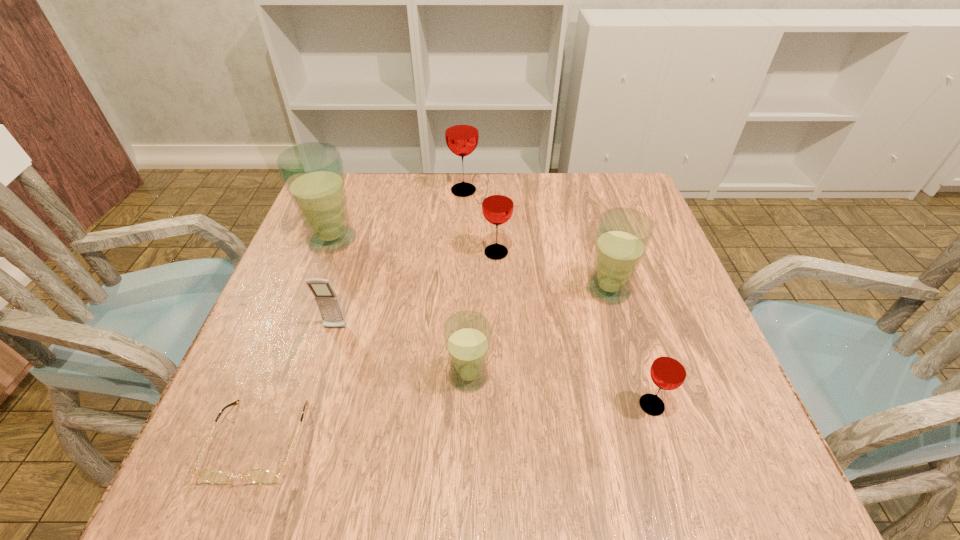
At what (x,y) coordinates should I click in order to perform the action: click on the farthest object. Please return your answer as a coordinate pair (x, y). This screenshot has height=540, width=960. Looking at the image, I should click on (461, 126).

Where is `the biggest red glass`? the biggest red glass is located at coordinates (461, 126).

Where is `the biggest blue glass`? This screenshot has width=960, height=540. the biggest blue glass is located at coordinates (313, 173).

You are a GUI agent. You are given a task and a screenshot of the screen. Output one action in this format:
    pyautogui.click(x=<x>, y=<y>)
    Task: Click on the leftmost glass
    
    Given the screenshot: What is the action you would take?
    pyautogui.click(x=313, y=173)

At what (x,y) coordinates should I click in order to perform the action: click on the second farthest red glass. Please return your answer as a coordinate pair (x, y). This screenshot has height=540, width=960. Looking at the image, I should click on (497, 207).

This screenshot has height=540, width=960. What are the coordinates of `the second smallest red glass` in the screenshot? It's located at (x=497, y=207).

Where is `the fourth farthest object`? the fourth farthest object is located at coordinates (623, 235).

Where is `the rightmost blue glass`? The height and width of the screenshot is (540, 960). the rightmost blue glass is located at coordinates (623, 235).

Identify the location of the fourth nearest object. (327, 301).

At what (x,y) coordinates should I click in order to perform the action: click on cellular telephone. Please return your answer as a coordinate pair (x, y). Looking at the image, I should click on (327, 301).